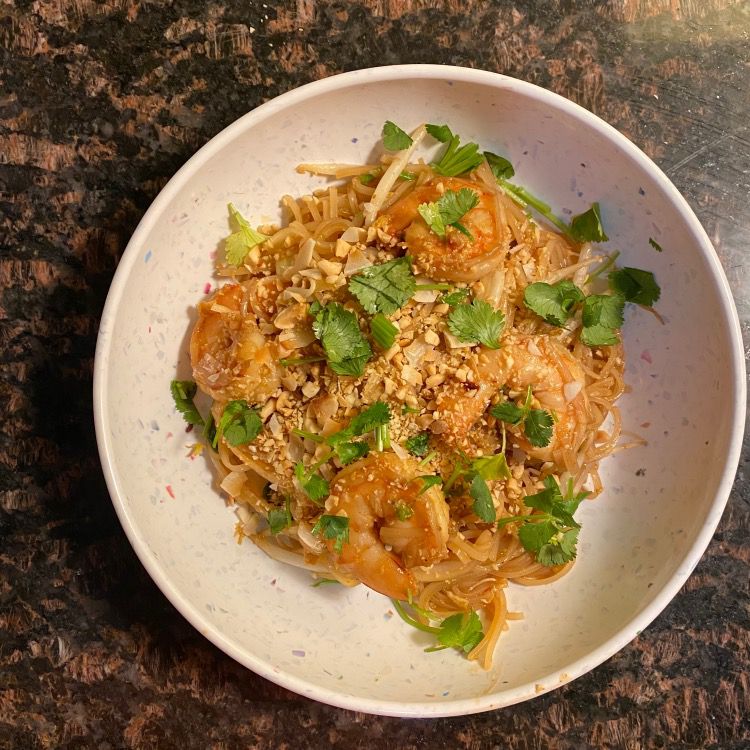
Find the location of a particular element. The width and height of the screenshot is (750, 750). white bowl rim is located at coordinates (302, 688), (100, 446), (627, 631), (714, 256), (151, 207), (422, 67).